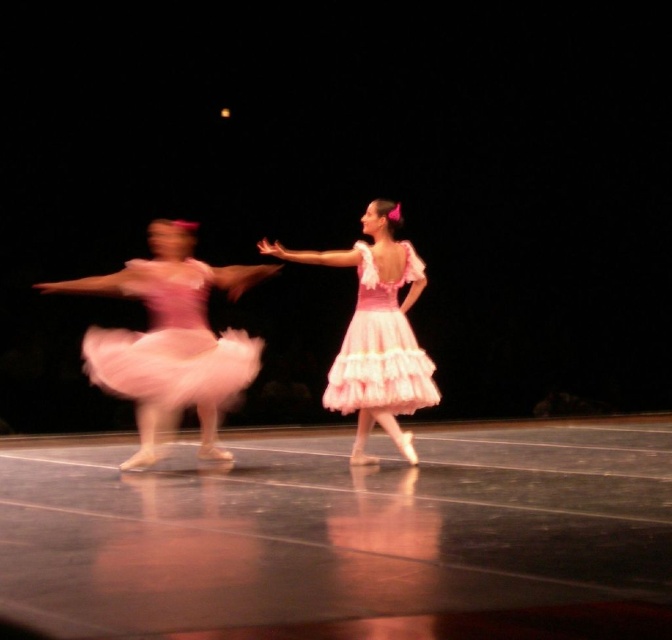
You are a stagehand preparing to place a spotlight on the matte pink tulle dress at left. The stage coordinates are mapped from 0 to 1 in both x and y axes. Where should you aim the spotlight to ensure it hits the dress?

The matte pink tulle dress at left is located at coordinates point (171, 342), so aim the spotlight at those coordinates to hit the dress.

You are a stagehand setting up a spotlight for the ballet performance. You need to ensure the light focuses on the matte pink tutu at left and the matte pink tutu at center. Which tutu should you adjust the spotlight to reach first if you want to light the one closer to the front?

The matte pink tutu at left is in front of the matte pink tutu at center, so you should adjust the spotlight to reach the matte pink tutu at left first since it is closer to the front.